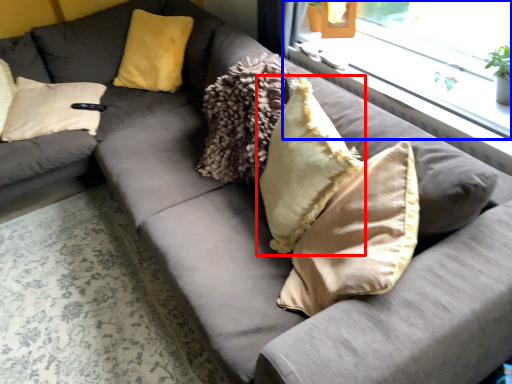
Question: Which of the following is the farthest to the observer, pillow (highlighted by a red box) or window (highlighted by a blue box)?

Choices:
 (A) pillow
 (B) window

Answer: (B)